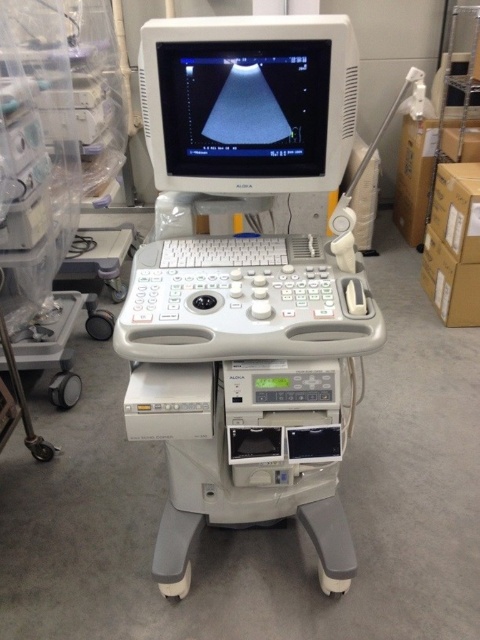
Question: Can you confirm if white plastic ultrasound machine at center is wider than white plastic monitor at upper center?

Choices:
 (A) yes
 (B) no

Answer: (A)

Question: Which point is closer to the camera?

Choices:
 (A) (347, 93)
 (B) (188, 124)

Answer: (A)

Question: Is white plastic ultrasound machine at center wider than white plastic monitor at upper center?

Choices:
 (A) no
 (B) yes

Answer: (B)

Question: Does white plastic ultrasound machine at center appear on the left side of white plastic monitor at upper center?

Choices:
 (A) yes
 (B) no

Answer: (B)

Question: Which object is closer to the camera taking this photo?

Choices:
 (A) white plastic monitor at upper center
 (B) white plastic ultrasound machine at center

Answer: (B)